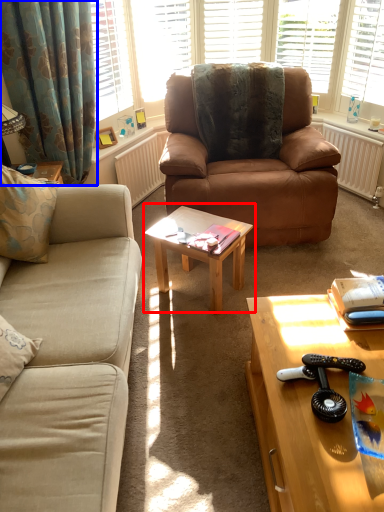
Question: Which of the following is the farthest to the observer, coffee table (highlighted by a red box) or curtain (highlighted by a blue box)?

Choices:
 (A) coffee table
 (B) curtain

Answer: (B)